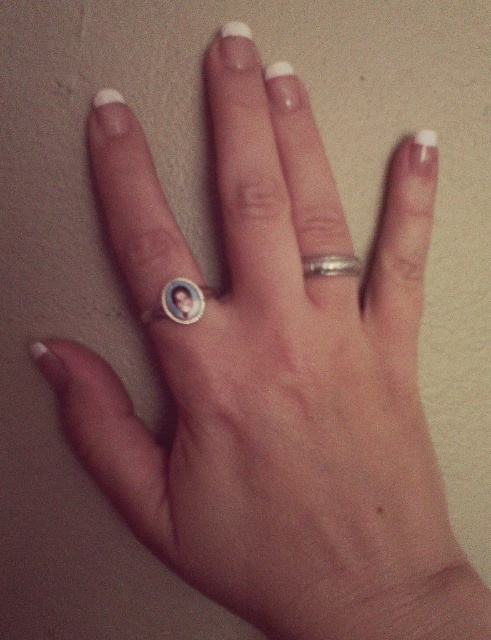
Question: Can you confirm if gold/enamel portrait ring at center is positioned above silver metallic ring at center?

Choices:
 (A) yes
 (B) no

Answer: (B)

Question: Among these points, which one is farthest from the camera?

Choices:
 (A) (357, 273)
 (B) (194, 300)

Answer: (A)

Question: Which object is farther from the camera taking this photo?

Choices:
 (A) gold/enamel portrait ring at center
 (B) silver metallic ring at center

Answer: (B)

Question: Can you confirm if gold/enamel portrait ring at center is bigger than silver metallic ring at center?

Choices:
 (A) yes
 (B) no

Answer: (B)

Question: Is gold/enamel portrait ring at center bigger than silver metallic ring at center?

Choices:
 (A) no
 (B) yes

Answer: (A)